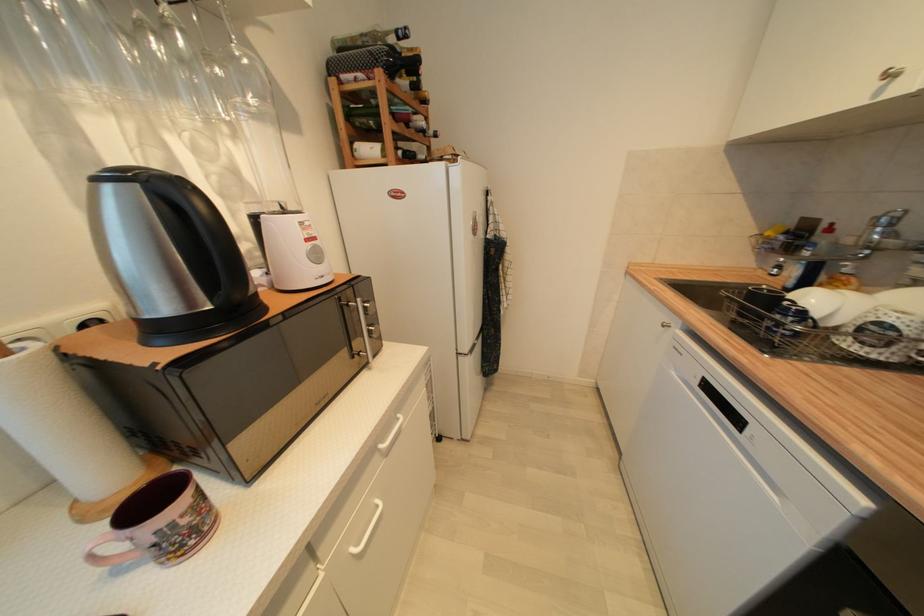
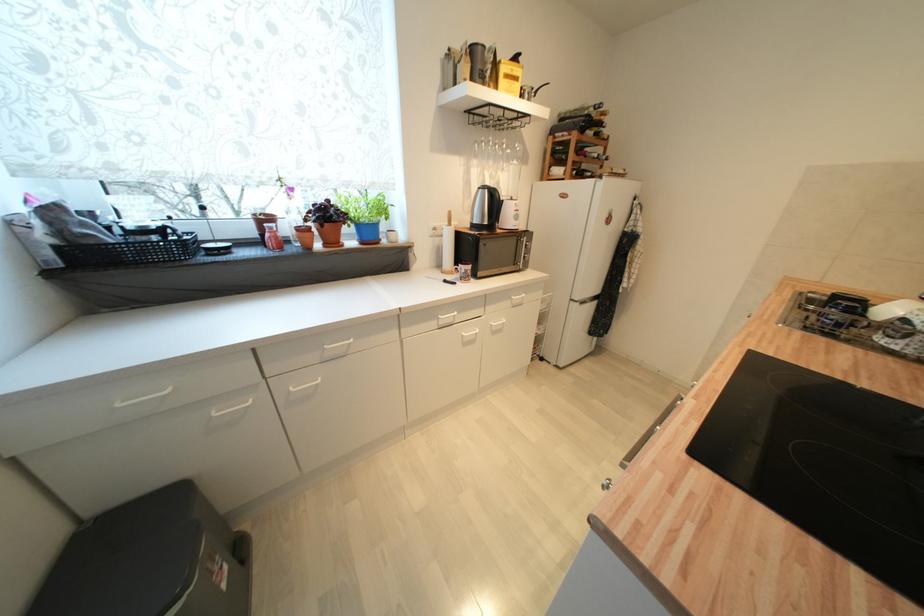
Locate, in the second image, the point that corresponds to point (477, 352) in the first image.

(587, 304)